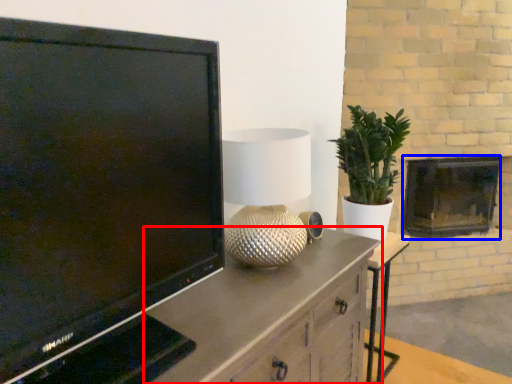
Question: Which object appears farthest to the camera in this image, cabinetry (highlighted by a red box) or fireplace (highlighted by a blue box)?

Choices:
 (A) cabinetry
 (B) fireplace

Answer: (B)